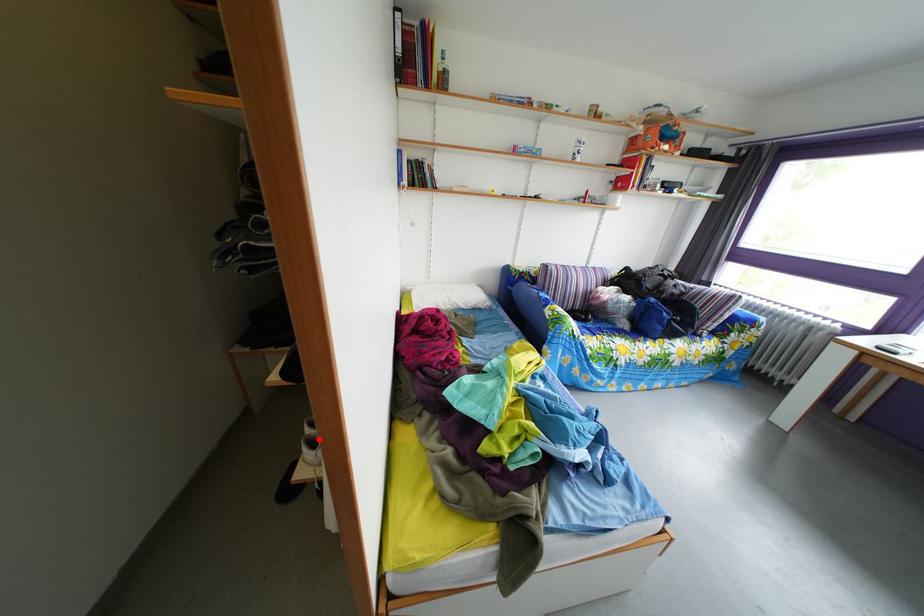
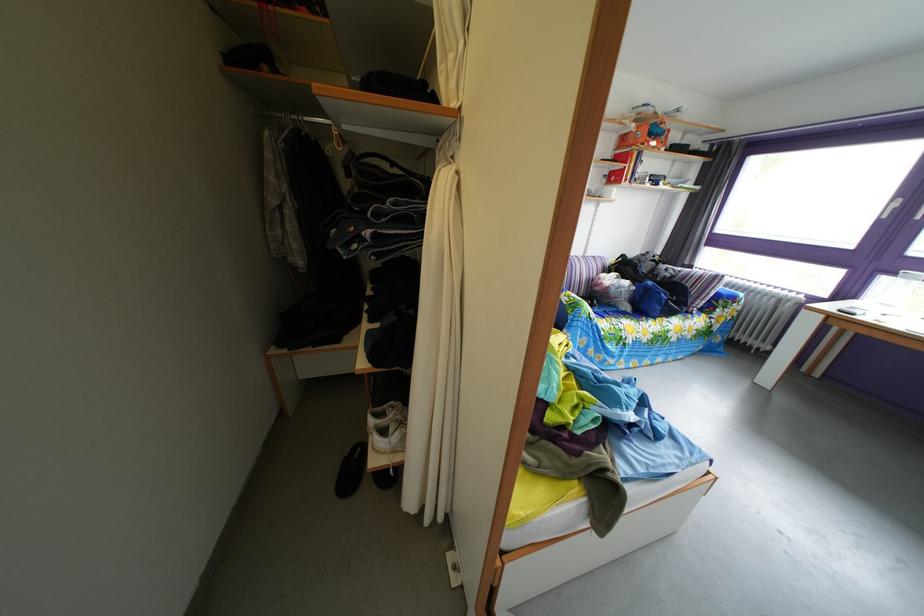
Question: I am providing you with two images of the same scene from different viewpoints. Given a red point in image1, look at the same physical point in image2. Is it:

Choices:
 (A) Closer to the viewpoint
 (B) Farther from the viewpoint

Answer: (A)